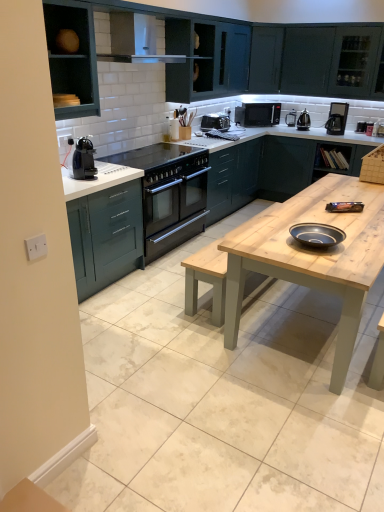
You are a GUI agent. You are given a task and a screenshot of the screen. Output one action in this format:
    pyautogui.click(x=<x>, y=<y>)
    Task: Click on the vacant space in front of metallic silver kettle at upper right, which appears as the third appliance when viewed from the right
    Image resolution: width=384 pixels, height=512 pixels.
    Given the screenshot: What is the action you would take?
    pyautogui.click(x=299, y=124)